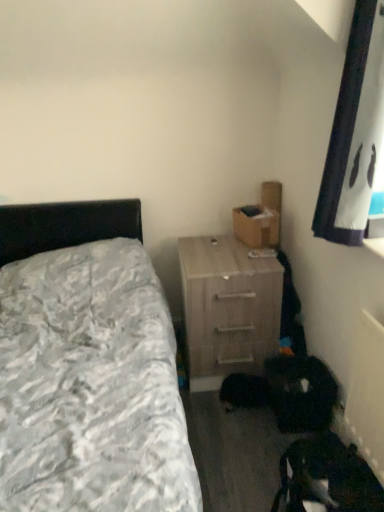
You are a GUI agent. You are given a task and a screenshot of the screen. Output one action in this format:
    pyautogui.click(x=<x>, y=<y>)
    Task: Click on the vacant position to the left of brown cardboard box at upper right
    This screenshot has height=512, width=384.
    Given the screenshot: What is the action you would take?
    pyautogui.click(x=213, y=242)